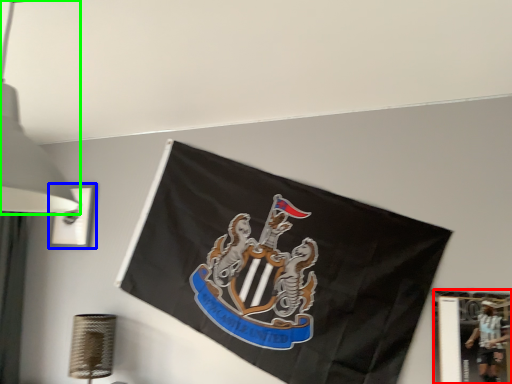
Question: Which object is the closest to the picture frame (highlighted by a red box)? Choose among these: picture frame (highlighted by a blue box) or lamp (highlighted by a green box).

Choices:
 (A) picture frame
 (B) lamp

Answer: (B)